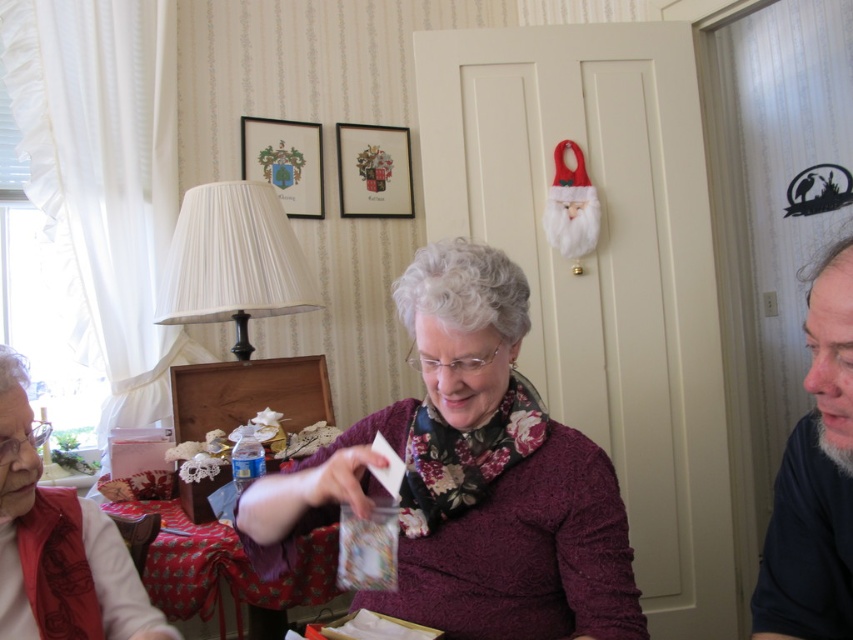
Question: Does gray beard at right have a smaller size compared to matte purple sweater at center?

Choices:
 (A) no
 (B) yes

Answer: (A)

Question: Which point is closer to the camera?

Choices:
 (A) (154, 634)
 (B) (218, 602)
 (C) (809, 480)
 (D) (494, 545)

Answer: (C)

Question: Which object is positioned closest to the purple textured sweater at center?

Choices:
 (A) matte purple sweater at center
 (B) red fabric tablecloth at lower center

Answer: (A)

Question: Is purple textured sweater at center above red fabric tablecloth at lower center?

Choices:
 (A) no
 (B) yes

Answer: (B)

Question: Does gray beard at right appear under matte purple sweater at center?

Choices:
 (A) no
 (B) yes

Answer: (A)

Question: Which object appears closest to the camera in this image?

Choices:
 (A) matte purple sweater at center
 (B) purple textured sweater at center

Answer: (B)